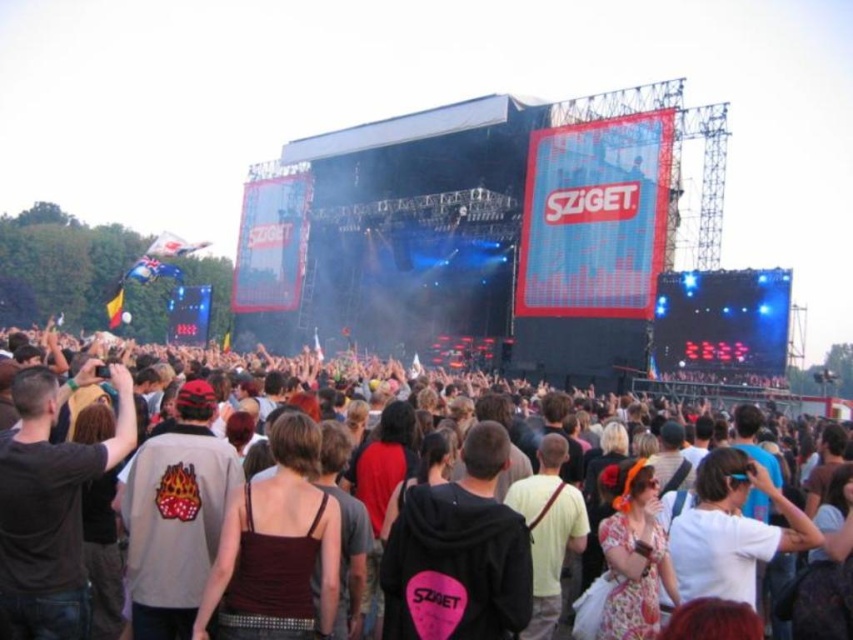
Which is more to the right, brown fabric crowd at center or dark brown fabric tank top at center?

Positioned to the right is brown fabric crowd at center.

Does brown fabric crowd at center have a lesser height compared to dark brown fabric tank top at center?

Incorrect, brown fabric crowd at center's height does not fall short of dark brown fabric tank top at center's.

Who is more distant from viewer, (199, 605) or (267, 509)?

The point (267, 509) is more distant.

At what (x,y) coordinates should I click in order to perform the action: click on brown fabric crowd at center. Please return your answer as a coordinate pair (x, y). The height and width of the screenshot is (640, 853). Looking at the image, I should click on (331, 538).